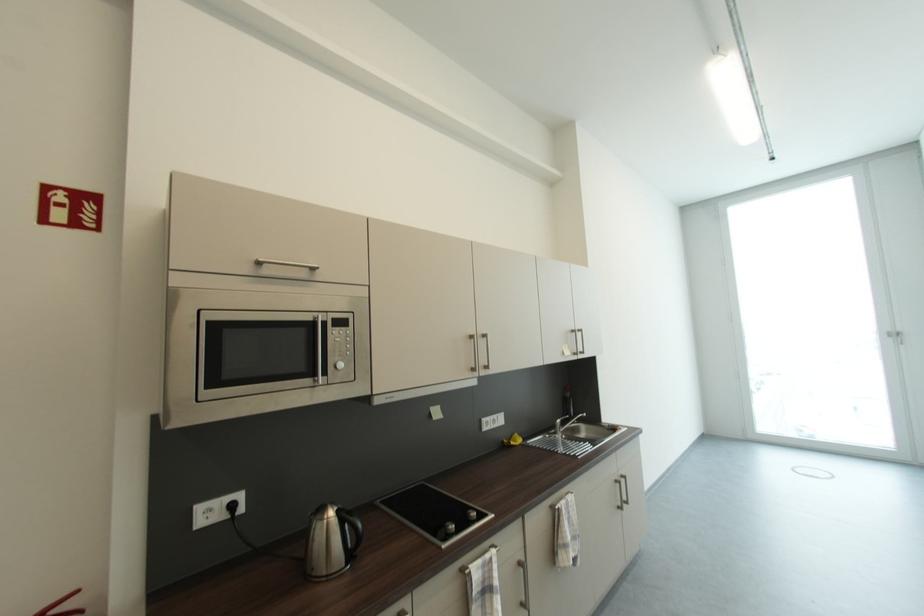
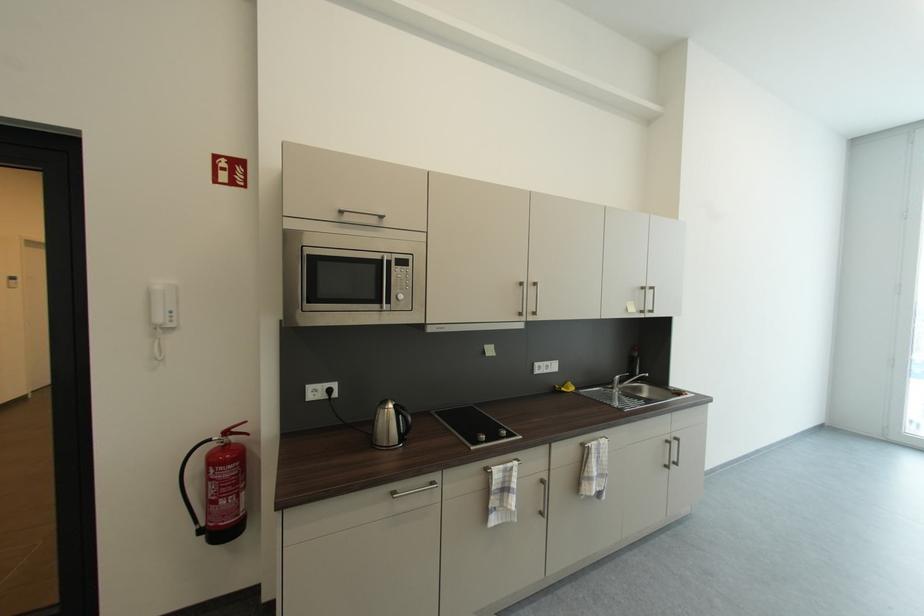
Locate, in the second image, the point that corresponds to (561,428) in the first image.

(618, 383)